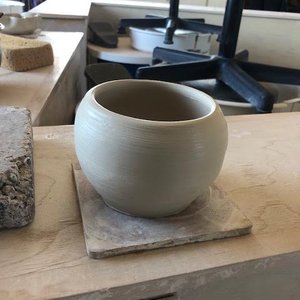
Identify the location of cup. (12, 13).